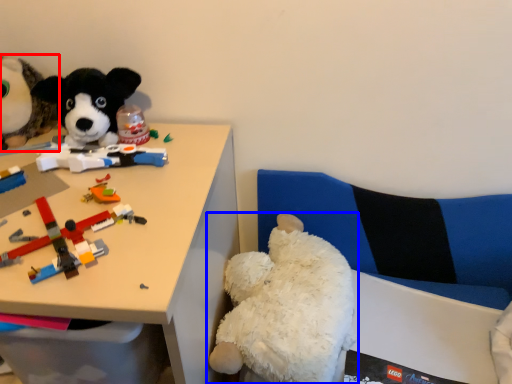
Question: Among these objects, which one is farthest to the camera, toy (highlighted by a red box) or toy (highlighted by a blue box)?

Choices:
 (A) toy
 (B) toy

Answer: (A)